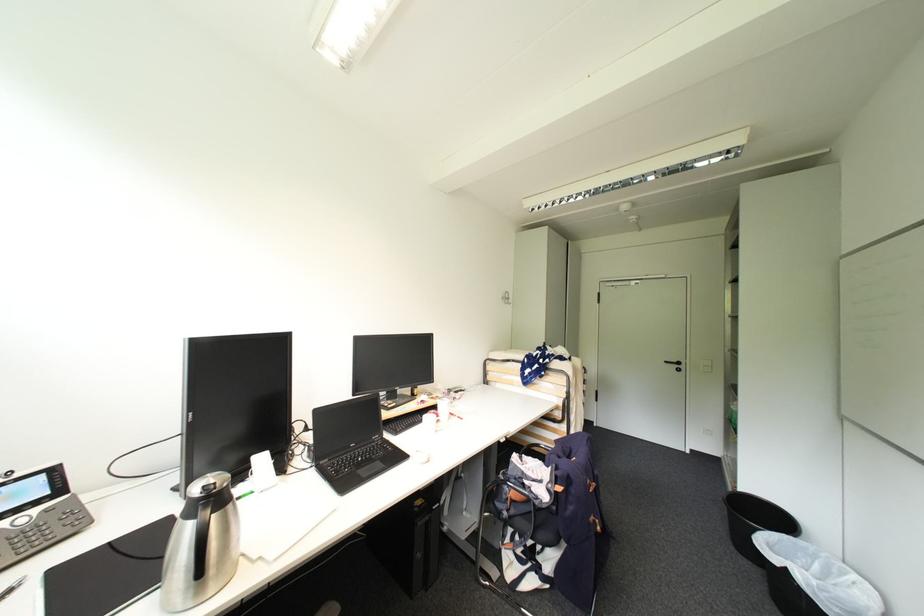
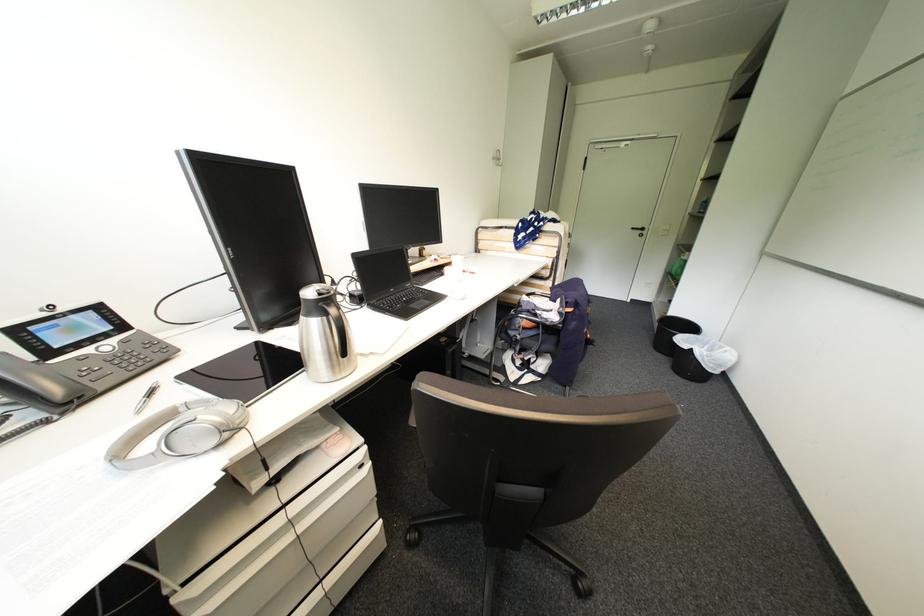
Question: Based on the continuous images, in which direction is the camera rotating? Reply with the corresponding letter.

Choices:
 (A) Left
 (B) Right
 (C) Up
 (D) Down

Answer: (D)